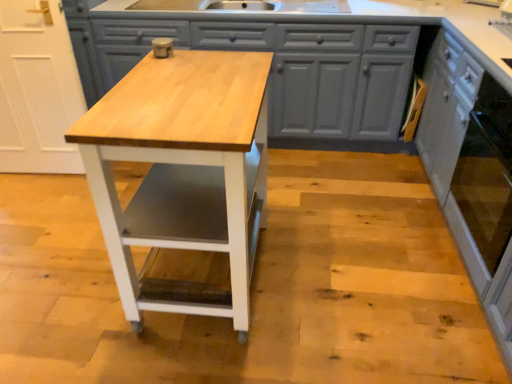
I want to click on matte gray cabinets at center, which is the second cabinetry from right to left, so click(292, 69).

The height and width of the screenshot is (384, 512). What are the coordinates of `white painted wood cabinet at right, marked as the second cabinetry in a left-to-right arrangement` in the screenshot? It's located at (472, 172).

Where is `matte gray cabinets at center, placed as the first cabinetry when sorted from left to right`? matte gray cabinets at center, placed as the first cabinetry when sorted from left to right is located at coordinates (292, 69).

The image size is (512, 384). Identify the location of the 1st cabinetry above the natural wood table at center (from the image's perspective). (472, 172).

Considering the relative sizes of natural wood table at center and white painted wood cabinet at right, arranged as the 1th cabinetry when viewed from the right, in the image provided, is natural wood table at center shorter than white painted wood cabinet at right, arranged as the 1th cabinetry when viewed from the right,?

Yes.

In terms of width, does natural wood table at center look wider or thinner when compared to white painted wood cabinet at right, arranged as the 1th cabinetry when viewed from the right?

Clearly, natural wood table at center has more width compared to white painted wood cabinet at right, arranged as the 1th cabinetry when viewed from the right.

Which object is thinner, matte gray cabinets at center, which is the second cabinetry from right to left, or white painted wood cabinet at right, marked as the second cabinetry in a left-to-right arrangement?

Thinner between the two is white painted wood cabinet at right, marked as the second cabinetry in a left-to-right arrangement.

Between matte gray cabinets at center, placed as the first cabinetry when sorted from left to right, and white painted wood cabinet at right, arranged as the 1th cabinetry when viewed from the right, which one has smaller size?

white painted wood cabinet at right, arranged as the 1th cabinetry when viewed from the right, is smaller.

From the image's perspective, is matte gray cabinets at center, which is the second cabinetry from right to left, beneath white painted wood cabinet at right, marked as the second cabinetry in a left-to-right arrangement?

Actually, matte gray cabinets at center, which is the second cabinetry from right to left, appears above white painted wood cabinet at right, marked as the second cabinetry in a left-to-right arrangement, in the image.

I want to click on cabinetry on the left of white painted wood cabinet at right, arranged as the 1th cabinetry when viewed from the right, so click(x=292, y=69).

From a real-world perspective, is white painted wood cabinet at right, marked as the second cabinetry in a left-to-right arrangement, located higher than matte gray cabinets at center, placed as the first cabinetry when sorted from left to right?

Yes, from a real-world perspective, white painted wood cabinet at right, marked as the second cabinetry in a left-to-right arrangement, is on top of matte gray cabinets at center, placed as the first cabinetry when sorted from left to right.

Where is `cabinetry lying behind the white painted wood cabinet at right, marked as the second cabinetry in a left-to-right arrangement`? The image size is (512, 384). cabinetry lying behind the white painted wood cabinet at right, marked as the second cabinetry in a left-to-right arrangement is located at coordinates (292, 69).

Is white painted wood cabinet at right, marked as the second cabinetry in a left-to-right arrangement, in contact with matte gray cabinets at center, placed as the first cabinetry when sorted from left to right?

white painted wood cabinet at right, marked as the second cabinetry in a left-to-right arrangement, and matte gray cabinets at center, placed as the first cabinetry when sorted from left to right, are clearly separated.

Is white painted wood cabinet at right, marked as the second cabinetry in a left-to-right arrangement, looking in the opposite direction of matte gray cabinets at center, placed as the first cabinetry when sorted from left to right?

white painted wood cabinet at right, marked as the second cabinetry in a left-to-right arrangement, does not have its back to matte gray cabinets at center, placed as the first cabinetry when sorted from left to right.

Which is behind, point (385, 70) or point (128, 227)?

The point (385, 70) is behind.

In terms of width, does matte gray cabinets at center, which is the second cabinetry from right to left, look wider or thinner when compared to natural wood table at center?

In the image, matte gray cabinets at center, which is the second cabinetry from right to left, appears to be wider than natural wood table at center.

Considering the sizes of objects matte gray cabinets at center, which is the second cabinetry from right to left, and natural wood table at center in the image provided, who is smaller, matte gray cabinets at center, which is the second cabinetry from right to left, or natural wood table at center?

Smaller between the two is natural wood table at center.

Could you tell me if matte gray cabinets at center, placed as the first cabinetry when sorted from left to right, is facing natural wood table at center?

Yes, matte gray cabinets at center, placed as the first cabinetry when sorted from left to right, is turned towards natural wood table at center.

From the image's perspective, does natural wood table at center appear higher than matte gray cabinets at center, which is the second cabinetry from right to left?

No.

In order to click on table on the left of matte gray cabinets at center, placed as the first cabinetry when sorted from left to right in this screenshot , I will do `click(183, 173)`.

Between natural wood table at center and matte gray cabinets at center, placed as the first cabinetry when sorted from left to right, which one has smaller size?

natural wood table at center is smaller.

Is natural wood table at center outside of matte gray cabinets at center, placed as the first cabinetry when sorted from left to right?

Indeed, natural wood table at center is completely outside matte gray cabinets at center, placed as the first cabinetry when sorted from left to right.

How different are the orientations of white painted wood cabinet at right, marked as the second cabinetry in a left-to-right arrangement, and natural wood table at center in degrees?

There is a 1.92-degree angle between the facing directions of white painted wood cabinet at right, marked as the second cabinetry in a left-to-right arrangement, and natural wood table at center.

In the scene shown: Is white painted wood cabinet at right, marked as the second cabinetry in a left-to-right arrangement, positioned behind natural wood table at center?

No, it is in front of natural wood table at center.

Could natural wood table at center be considered to be inside white painted wood cabinet at right, arranged as the 1th cabinetry when viewed from the right?

Actually, natural wood table at center is outside white painted wood cabinet at right, arranged as the 1th cabinetry when viewed from the right.

How much distance is there between white painted wood cabinet at right, marked as the second cabinetry in a left-to-right arrangement, and natural wood table at center?

white painted wood cabinet at right, marked as the second cabinetry in a left-to-right arrangement, and natural wood table at center are 1.06 meters apart from each other.

This screenshot has height=384, width=512. Identify the location of table on the left of white painted wood cabinet at right, marked as the second cabinetry in a left-to-right arrangement. pos(183,173).

The height and width of the screenshot is (384, 512). In the image, there is a matte gray cabinets at center, which is the second cabinetry from right to left. Identify the location of cabinetry below it (from the image's perspective). (472, 172).

Based on their spatial positions, is matte gray cabinets at center, placed as the first cabinetry when sorted from left to right, or white painted wood cabinet at right, arranged as the 1th cabinetry when viewed from the right, closer to natural wood table at center?

Among the two, matte gray cabinets at center, placed as the first cabinetry when sorted from left to right, is located nearer to natural wood table at center.

Based on their spatial positions, is natural wood table at center or matte gray cabinets at center, placed as the first cabinetry when sorted from left to right, closer to white painted wood cabinet at right, marked as the second cabinetry in a left-to-right arrangement?

Among the two, matte gray cabinets at center, placed as the first cabinetry when sorted from left to right, is located nearer to white painted wood cabinet at right, marked as the second cabinetry in a left-to-right arrangement.

Which object lies nearer to the anchor point white painted wood cabinet at right, arranged as the 1th cabinetry when viewed from the right, matte gray cabinets at center, placed as the first cabinetry when sorted from left to right, or natural wood table at center?

matte gray cabinets at center, placed as the first cabinetry when sorted from left to right, lies closer to white painted wood cabinet at right, arranged as the 1th cabinetry when viewed from the right, than the other object.

Based on their spatial positions, is natural wood table at center or white painted wood cabinet at right, marked as the second cabinetry in a left-to-right arrangement, further from matte gray cabinets at center, which is the second cabinetry from right to left?

natural wood table at center.

Based on their spatial positions, is white painted wood cabinet at right, arranged as the 1th cabinetry when viewed from the right, or matte gray cabinets at center, which is the second cabinetry from right to left, further from natural wood table at center?

Among the two, white painted wood cabinet at right, arranged as the 1th cabinetry when viewed from the right, is located further to natural wood table at center.

Looking at the image, which one is located closer to matte gray cabinets at center, which is the second cabinetry from right to left, white painted wood cabinet at right, marked as the second cabinetry in a left-to-right arrangement, or natural wood table at center?

white painted wood cabinet at right, marked as the second cabinetry in a left-to-right arrangement, is positioned closer to the anchor matte gray cabinets at center, which is the second cabinetry from right to left.

The height and width of the screenshot is (384, 512). What are the coordinates of `cabinetry situated between natural wood table at center and white painted wood cabinet at right, arranged as the 1th cabinetry when viewed from the right, from left to right` in the screenshot? It's located at (292, 69).